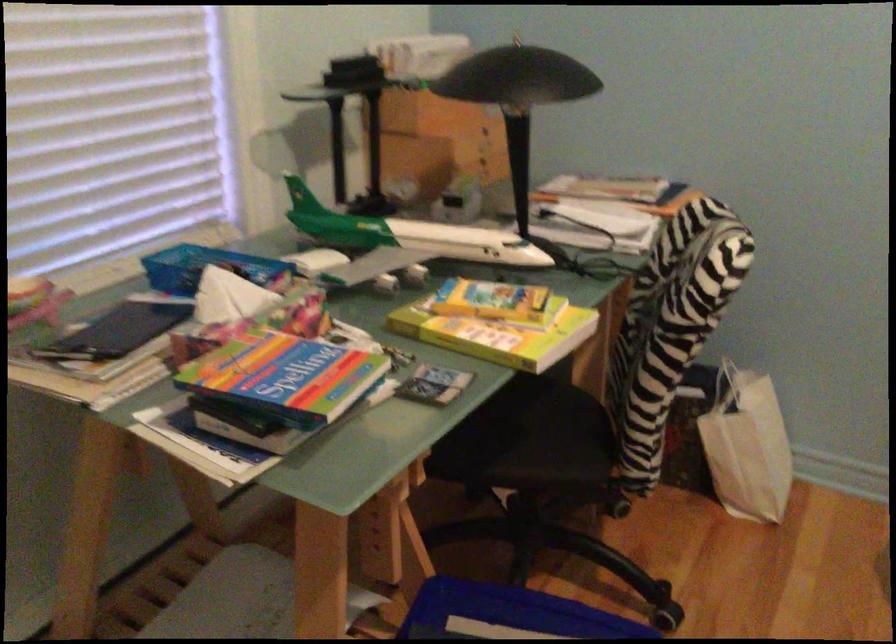
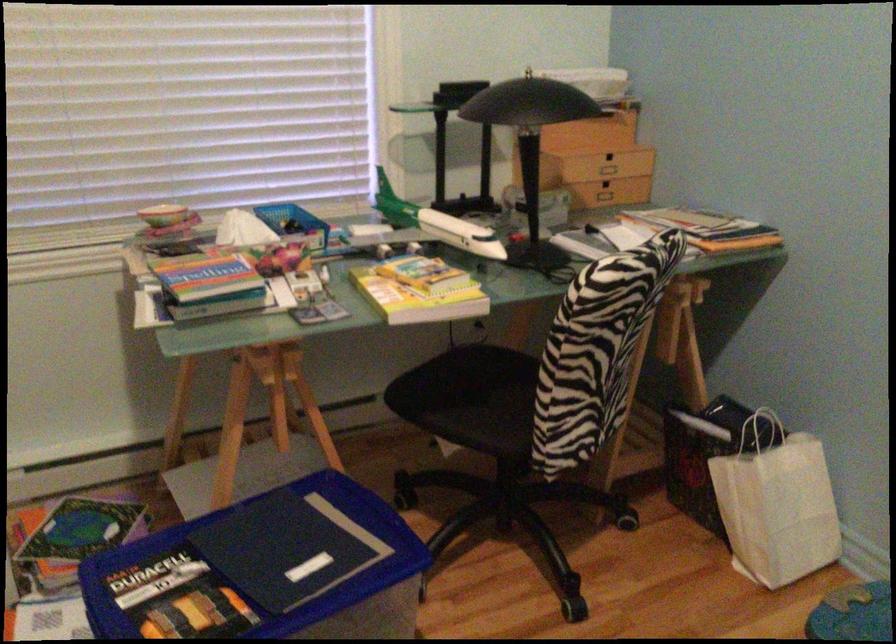
Find the pixel in the second image that matches (x=495, y=167) in the first image.

(616, 191)